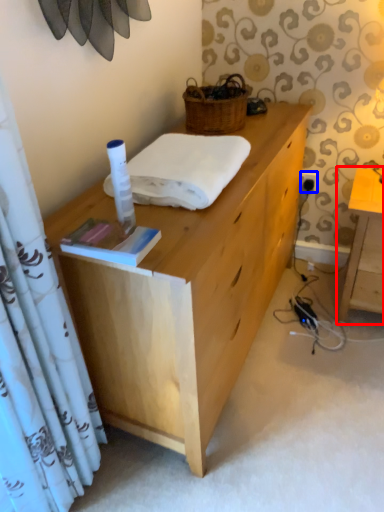
Question: Among these objects, which one is farthest to the camera, table (highlighted by a red box) or power outlet (highlighted by a blue box)?

Choices:
 (A) table
 (B) power outlet

Answer: (B)